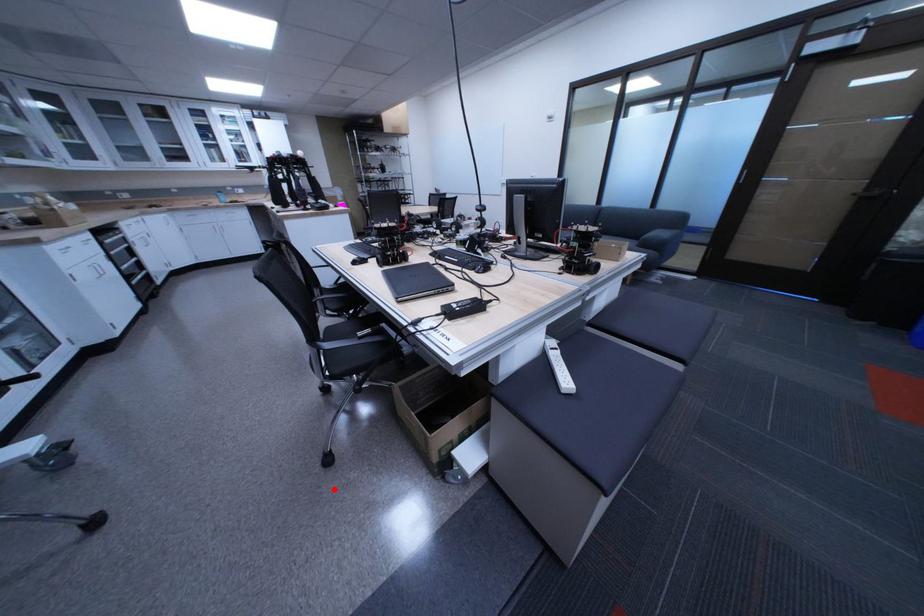
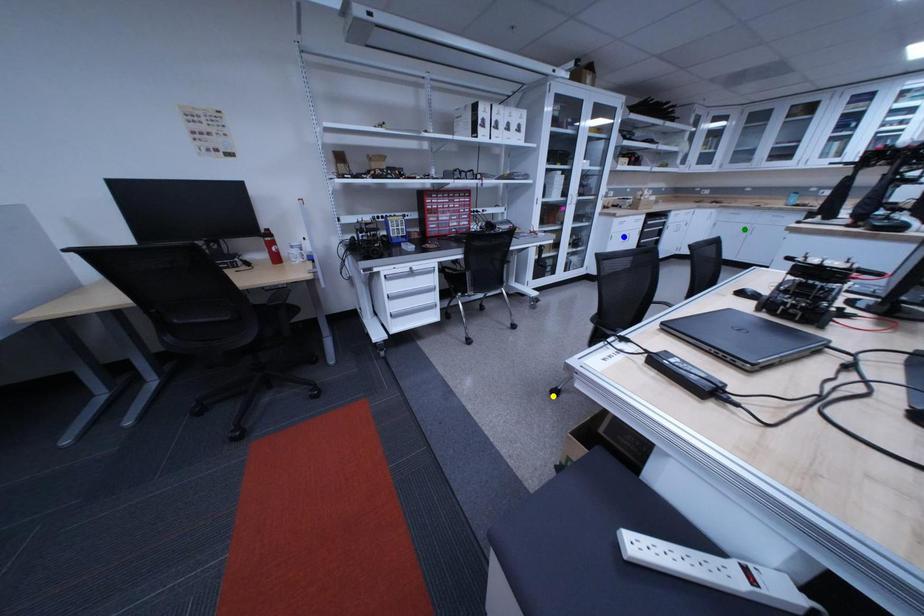
Question: I am providing you with two images of the same scene from different viewpoints. A red point is marked on the first image. You are given multiple points on the second image. Which spot in image 2 lines up with the point in image 1?

Choices:
 (A) yellow point
 (B) blue point
 (C) green point

Answer: (A)